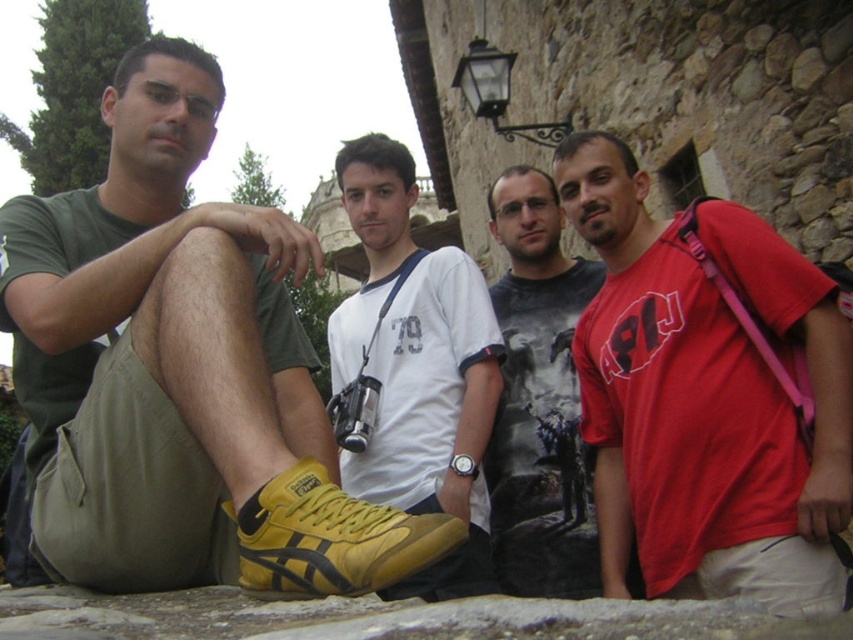
Question: Considering the real-world distances, which object is closest to the red matte shirt at center?

Choices:
 (A) yellow suede sneaker at lower left
 (B) dark gray printed t-shirt at center

Answer: (B)

Question: Which object appears farthest from the camera in this image?

Choices:
 (A) yellow suede sneaker at lower left
 (B) yellow leather shoe at center

Answer: (B)

Question: Is yellow leather shoe at center to the right of yellow suede sneaker at lower left from the viewer's perspective?

Choices:
 (A) yes
 (B) no

Answer: (A)

Question: Based on their relative distances, which object is nearer to the yellow suede sneaker at lower left?

Choices:
 (A) dark gray printed t-shirt at center
 (B) red matte shirt at center

Answer: (B)

Question: Does yellow leather shoe at lower left lie in front of yellow leather shoe at center?

Choices:
 (A) yes
 (B) no

Answer: (A)

Question: Can you confirm if yellow leather shoe at center is wider than yellow suede sneaker at lower left?

Choices:
 (A) yes
 (B) no

Answer: (A)